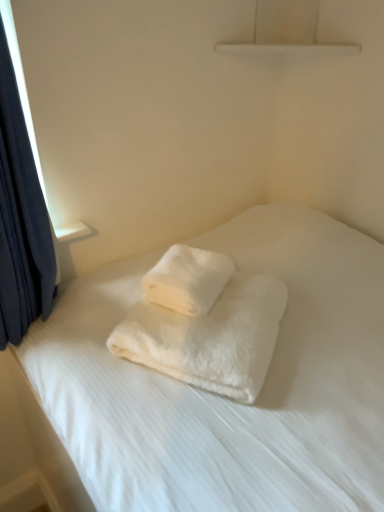
Where is `vacant space behind white fluffy towel at center, which ranks as the 2th towel in bottom-to-top order`? vacant space behind white fluffy towel at center, which ranks as the 2th towel in bottom-to-top order is located at coordinates (215, 246).